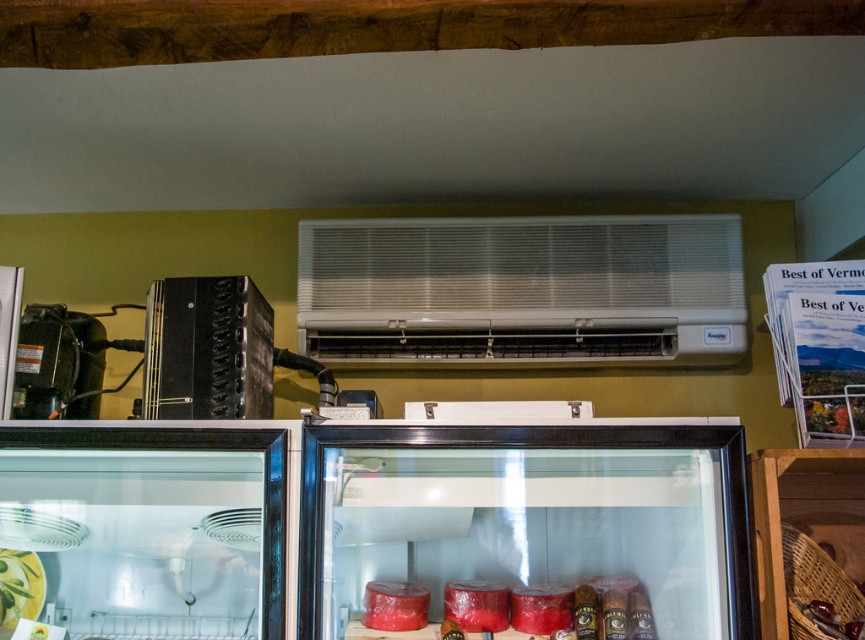
You are a delivery person who needs to place a new package on the shelf. The package is 1 meter wide. You see the black matte accordion at left and the shiny red meat at center. Can you fit the package between them?

The black matte accordion at left might be wider than shiny red meat at center, so the distance between them is uncertain. Without knowing the exact width of the black matte accordion at left and shiny red meat at center, it is impossible to determine if the 1 meter wide package will fit between them.

In the scene shown: You are a delivery person who needs to place a new package on top of the black matte accordion at left and the shiny red meat at center. Which object can you place the package on without it falling off?

The black matte accordion at left is taller than the shiny red meat at center, so placing the package on top of the black matte accordion at left would be more stable and less likely to fall off.